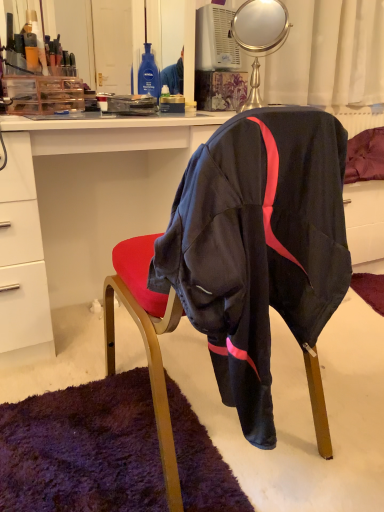
Question: Should I look upward or downward to see black fabric chair at center?

Choices:
 (A) up
 (B) down

Answer: (B)

Question: Considering the relative sizes of metallic gold mirror at upper center and white glossy desk at center in the image provided, is metallic gold mirror at upper center thinner than white glossy desk at center?

Choices:
 (A) no
 (B) yes

Answer: (B)

Question: Could you tell me if metallic gold mirror at upper center is facing white glossy desk at center?

Choices:
 (A) no
 (B) yes

Answer: (A)

Question: Is metallic gold mirror at upper center not within white glossy desk at center?

Choices:
 (A) yes
 (B) no

Answer: (A)

Question: Is metallic gold mirror at upper center facing away from white glossy desk at center?

Choices:
 (A) yes
 (B) no

Answer: (B)

Question: Does metallic gold mirror at upper center have a greater height compared to white glossy desk at center?

Choices:
 (A) no
 (B) yes

Answer: (A)

Question: Is the position of metallic gold mirror at upper center less distant than that of white glossy desk at center?

Choices:
 (A) no
 (B) yes

Answer: (A)

Question: Does black fabric chair at center appear on the right side of metallic gold mirror at upper center?

Choices:
 (A) yes
 (B) no

Answer: (B)

Question: Considering the relative positions of black fabric chair at center and metallic gold mirror at upper center in the image provided, is black fabric chair at center to the left of metallic gold mirror at upper center from the viewer's perspective?

Choices:
 (A) yes
 (B) no

Answer: (A)

Question: From the image's perspective, is black fabric chair at center located above metallic gold mirror at upper center?

Choices:
 (A) yes
 (B) no

Answer: (B)

Question: From a real-world perspective, is black fabric chair at center physically above metallic gold mirror at upper center?

Choices:
 (A) yes
 (B) no

Answer: (B)

Question: Does black fabric chair at center have a lesser width compared to metallic gold mirror at upper center?

Choices:
 (A) no
 (B) yes

Answer: (A)

Question: Is black fabric chair at center beside metallic gold mirror at upper center?

Choices:
 (A) no
 (B) yes

Answer: (A)

Question: Can you confirm if white glossy desk at center is thinner than metallic gold mirror at upper center?

Choices:
 (A) yes
 (B) no

Answer: (B)